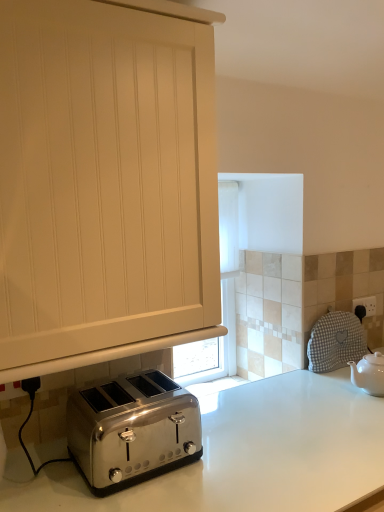
Question: Is white wood cabinet at center turned away from white glossy countertop at lower center?

Choices:
 (A) no
 (B) yes

Answer: (A)

Question: Could white glossy countertop at lower center be considered to be inside white wood cabinet at center?

Choices:
 (A) no
 (B) yes

Answer: (A)

Question: Is the depth of white wood cabinet at center greater than that of white glossy countertop at lower center?

Choices:
 (A) no
 (B) yes

Answer: (B)

Question: Could you tell me if white wood cabinet at center is facing white glossy countertop at lower center?

Choices:
 (A) yes
 (B) no

Answer: (B)

Question: Is white wood cabinet at center outside of white glossy countertop at lower center?

Choices:
 (A) yes
 (B) no

Answer: (A)

Question: Is black plastic electric outlet at upper right inside or outside of white ceramic teapot at right?

Choices:
 (A) inside
 (B) outside

Answer: (B)

Question: From a real-world perspective, is black plastic electric outlet at upper right positioned above or below white ceramic teapot at right?

Choices:
 (A) above
 (B) below

Answer: (A)

Question: In the image, is black plastic electric outlet at upper right positioned in front of or behind white ceramic teapot at right?

Choices:
 (A) front
 (B) behind

Answer: (B)

Question: Considering the positions of black plastic electric outlet at upper right and white ceramic teapot at right in the image, is black plastic electric outlet at upper right bigger or smaller than white ceramic teapot at right?

Choices:
 (A) small
 (B) big

Answer: (A)

Question: From a real-world perspective, is white wood cabinet at center above or below satin silver toaster at lower left?

Choices:
 (A) below
 (B) above

Answer: (B)

Question: Considering their positions, is white wood cabinet at center located in front of or behind satin silver toaster at lower left?

Choices:
 (A) front
 (B) behind

Answer: (A)

Question: In terms of height, does white wood cabinet at center look taller or shorter compared to satin silver toaster at lower left?

Choices:
 (A) tall
 (B) short

Answer: (A)

Question: From the image's perspective, is white wood cabinet at center positioned above or below satin silver toaster at lower left?

Choices:
 (A) above
 (B) below

Answer: (A)

Question: From the image's perspective, relative to white wood cabinet at center, is white glossy countertop at lower center above or below?

Choices:
 (A) below
 (B) above

Answer: (A)

Question: Is point (57, 462) closer or farther from the camera than point (4, 216)?

Choices:
 (A) farther
 (B) closer

Answer: (A)